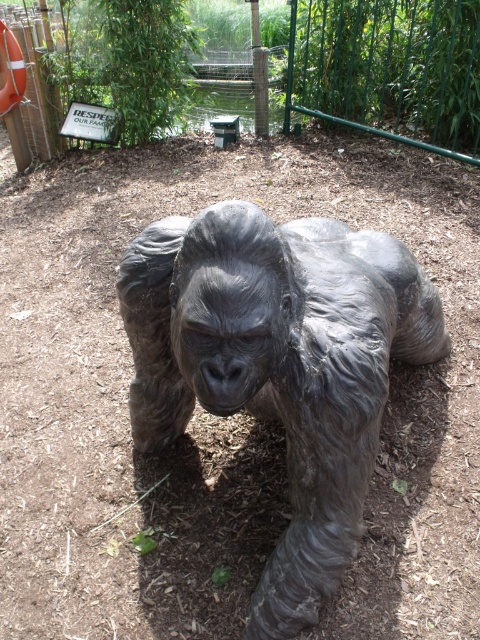
Question: Is bronze statue at center bigger than green metal fence at upper center?

Choices:
 (A) yes
 (B) no

Answer: (B)

Question: Which point is farther from the camera taking this photo?

Choices:
 (A) (365, 474)
 (B) (302, 33)

Answer: (B)

Question: Does bronze statue at center have a lesser width compared to green metal fence at upper center?

Choices:
 (A) no
 (B) yes

Answer: (B)

Question: In this image, where is bronze statue at center located relative to green metal fence at upper center?

Choices:
 (A) below
 (B) above

Answer: (A)

Question: Among these points, which one is nearest to the camera?

Choices:
 (A) (217, 348)
 (B) (382, 60)

Answer: (A)

Question: Which point is farther to the camera?

Choices:
 (A) green metal fence at upper center
 (B) bronze statue at center

Answer: (A)